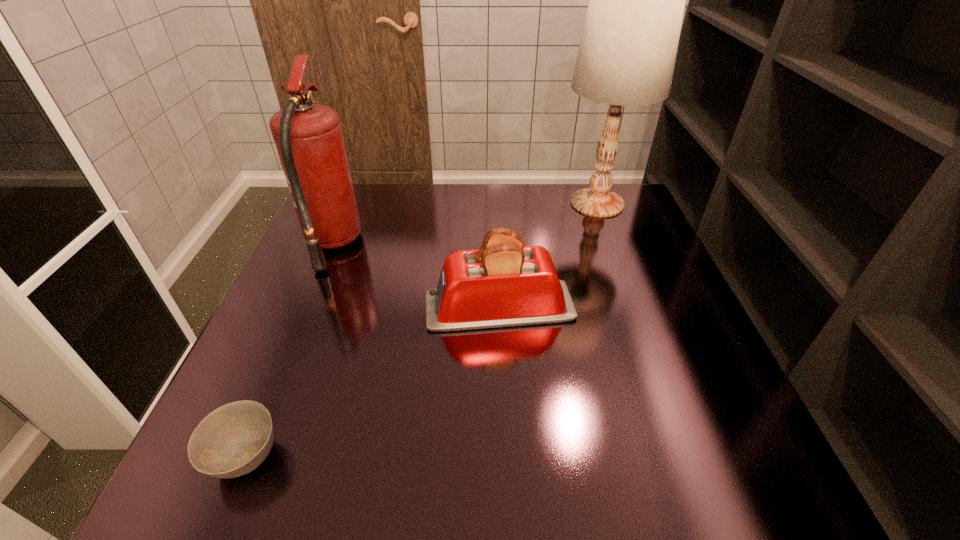
Image resolution: width=960 pixels, height=540 pixels. Find the location of `vacant area at the far edge of the desktop`. vacant area at the far edge of the desktop is located at coordinates (500, 204).

Find the location of a particular element. This screenshot has width=960, height=540. vacant space at the near edge of the desktop is located at coordinates (336, 453).

In the image, there is a desktop. Identify the location of vacant space at the left edge. Image resolution: width=960 pixels, height=540 pixels. (288, 367).

Locate an element on the screen. vacant position at the right edge of the desktop is located at coordinates (645, 377).

The height and width of the screenshot is (540, 960). In the image, there is a desktop. Find the location of `vacant space at the near right corner`. vacant space at the near right corner is located at coordinates (697, 488).

In order to click on free point between the bowl and the third shortest object in this screenshot , I will do `click(289, 350)`.

At what (x,y) coordinates should I click in order to perform the action: click on vacant space that's between the tallest object and the shortest object. Please return your answer as a coordinate pair (x, y). Looking at the image, I should click on (421, 330).

Find the location of `free space between the nearest object and the second shortest object`. free space between the nearest object and the second shortest object is located at coordinates (372, 382).

Find the location of a particular element. This screenshot has width=960, height=540. vacant space that's between the shortest object and the fire extinguisher is located at coordinates (289, 350).

Identify the location of free space between the shortest object and the third shortest object. (289, 350).